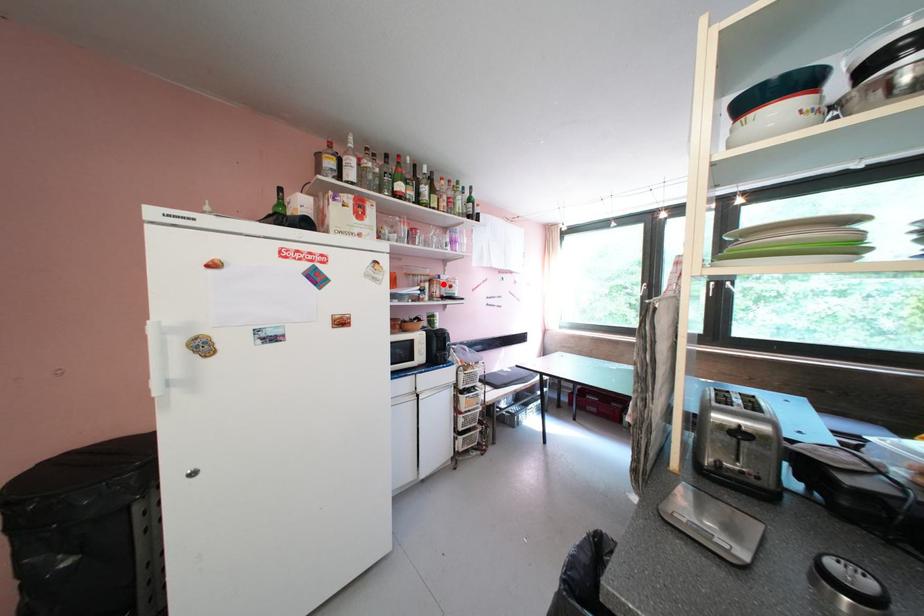
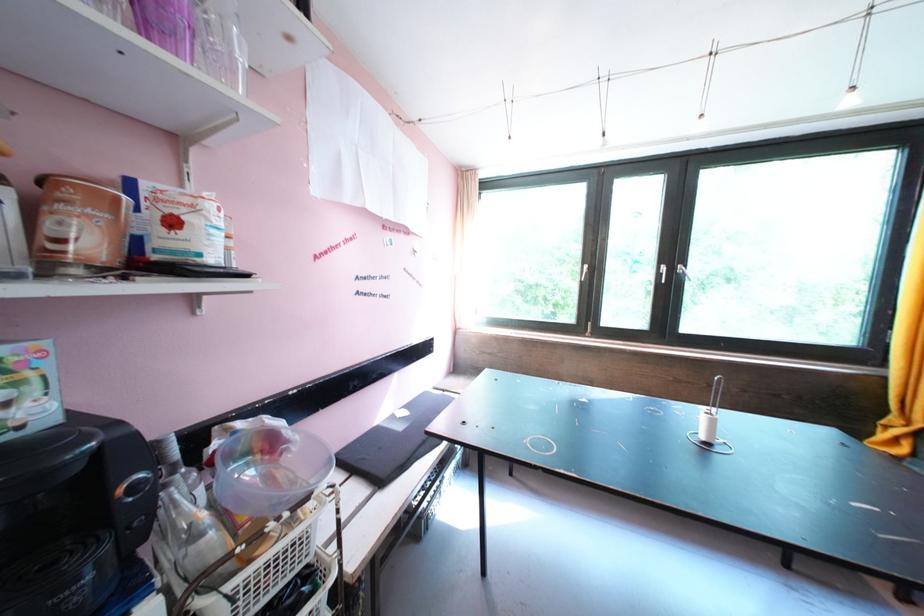
Where in the second image is the point corresponding to the highlighted location from the first image?

(78, 196)